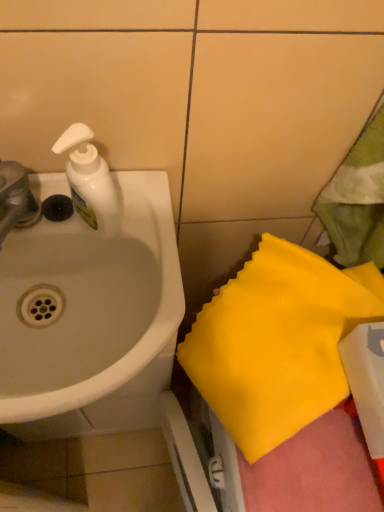
Question: From the image's perspective, is white glossy sink at left located above white plastic soap dispenser at upper left?

Choices:
 (A) no
 (B) yes

Answer: (A)

Question: Does white glossy sink at left have a larger size compared to white plastic soap dispenser at upper left?

Choices:
 (A) yes
 (B) no

Answer: (A)

Question: From the image's perspective, would you say white glossy sink at left is shown under white plastic soap dispenser at upper left?

Choices:
 (A) no
 (B) yes

Answer: (B)

Question: Does white glossy sink at left have a greater height compared to white plastic soap dispenser at upper left?

Choices:
 (A) no
 (B) yes

Answer: (A)

Question: Is white glossy sink at left placed right next to white plastic soap dispenser at upper left?

Choices:
 (A) yes
 (B) no

Answer: (B)

Question: Does white glossy sink at left lie in front of white plastic soap dispenser at upper left?

Choices:
 (A) yes
 (B) no

Answer: (A)

Question: Does white plastic soap dispenser at upper left turn towards yellow fabric at lower right?

Choices:
 (A) no
 (B) yes

Answer: (A)

Question: Considering the relative positions of white plastic soap dispenser at upper left and yellow fabric at lower right in the image provided, is white plastic soap dispenser at upper left in front of yellow fabric at lower right?

Choices:
 (A) no
 (B) yes

Answer: (B)

Question: From a real-world perspective, is white plastic soap dispenser at upper left over yellow fabric at lower right?

Choices:
 (A) yes
 (B) no

Answer: (A)

Question: Can you confirm if white plastic soap dispenser at upper left is bigger than yellow fabric at lower right?

Choices:
 (A) yes
 (B) no

Answer: (B)

Question: Can you confirm if white plastic soap dispenser at upper left is taller than yellow fabric at lower right?

Choices:
 (A) no
 (B) yes

Answer: (B)

Question: Is white plastic soap dispenser at upper left positioned with its back to yellow fabric at lower right?

Choices:
 (A) no
 (B) yes

Answer: (A)

Question: Is white glossy sink at left shorter than yellow fabric at lower right?

Choices:
 (A) yes
 (B) no

Answer: (A)